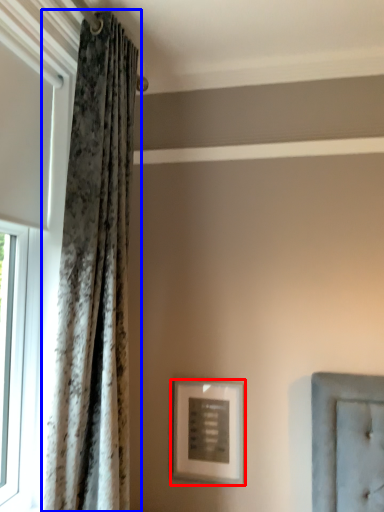
Question: Which of the following is the closest to the observer, picture frame (highlighted by a red box) or curtain (highlighted by a blue box)?

Choices:
 (A) picture frame
 (B) curtain

Answer: (B)